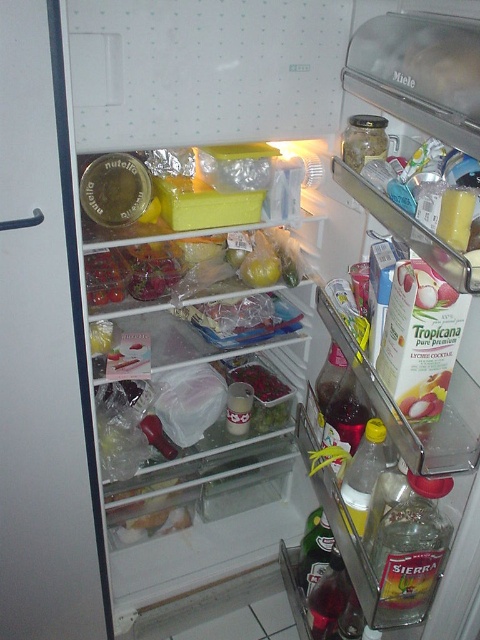
You are organizing the contents of the refrigerator and notice the matte plastic jar at left and the green leafy vegetables at center. Which item is taller?

The matte plastic jar at left is taller than the green leafy vegetables at center.

You are standing in front of the open Miele refrigerator and want to place a new item on the shelf. If you want to place it closer to the front of the refrigerator, which point should you choose between point (24, 161) and point (256, 380)?

Point (24, 161) is in front of point (256, 380), so placing the item at point (24, 161) would be closer to the front of the refrigerator.

Looking at this image, you are standing in front of a Miele refrigerator. There are two points inside the fridge at coordinates point [1,19]. How far apart are these two points?

The two points at point [1,19] are 31.19 inches apart.